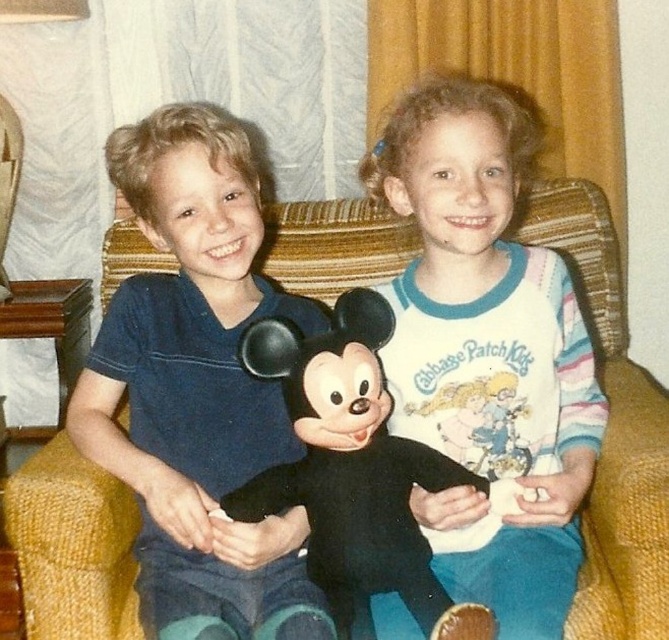
Question: Does white cotton shirt at upper center have a smaller size compared to yellow fabric couch at center?

Choices:
 (A) no
 (B) yes

Answer: (B)

Question: Where is white cotton shirt at upper center located in relation to yellow fabric couch at center in the image?

Choices:
 (A) right
 (B) left

Answer: (B)

Question: Considering the relative positions of white cotton shirt at upper center and black plush toy at center in the image provided, where is white cotton shirt at upper center located with respect to black plush toy at center?

Choices:
 (A) left
 (B) right

Answer: (B)

Question: Which is farther from the black plush toy at center?

Choices:
 (A) white cotton shirt at upper center
 (B) yellow fabric couch at center

Answer: (B)

Question: Which object is positioned closest to the matte blue shirt at center?

Choices:
 (A) white cotton shirt at upper center
 (B) black plush toy at center

Answer: (B)

Question: Which is farther from the yellow fabric couch at center?

Choices:
 (A) matte blue shirt at center
 (B) black plush toy at center

Answer: (A)